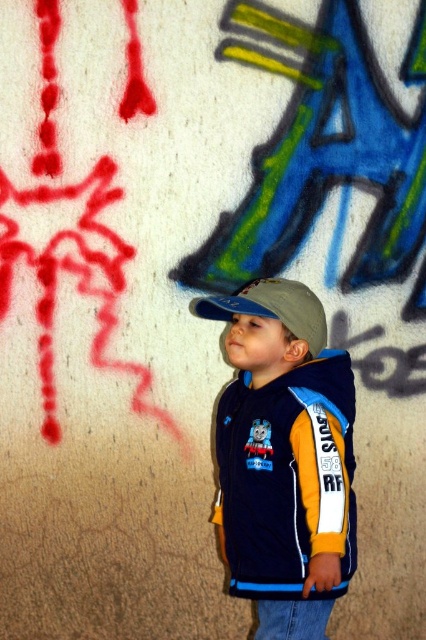
Is matte blue cap at center to the left of matte gray baseball cap at center from the viewer's perspective?

Incorrect, matte blue cap at center is not on the left side of matte gray baseball cap at center.

Does matte blue cap at center have a lesser height compared to matte gray baseball cap at center?

No.

The height and width of the screenshot is (640, 426). Describe the element at coordinates (284, 458) in the screenshot. I see `matte blue cap at center` at that location.

Locate an element on the screen. The width and height of the screenshot is (426, 640). matte blue cap at center is located at coordinates (284, 458).